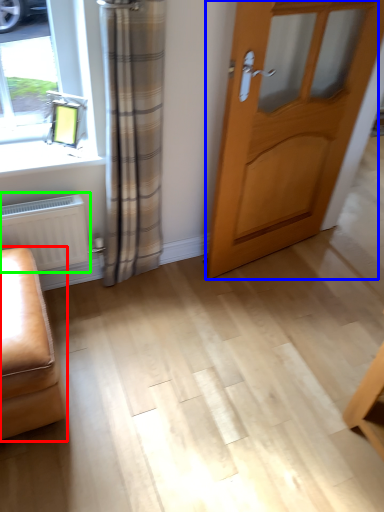
Question: Which is nearer to the furniture (highlighted by a red box)? door (highlighted by a blue box) or radiator (highlighted by a green box).

Choices:
 (A) door
 (B) radiator

Answer: (B)